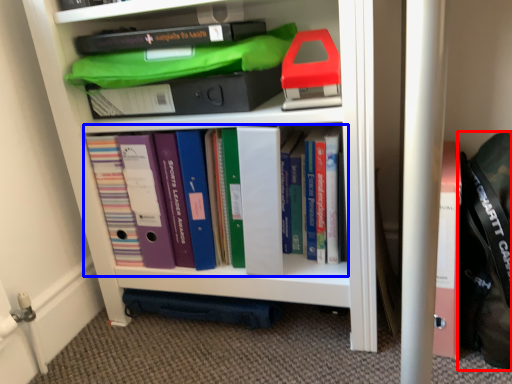
Question: Among these objects, which one is nearest to the camera, messenger bag (highlighted by a red box) or book (highlighted by a blue box)?

Choices:
 (A) messenger bag
 (B) book

Answer: (A)